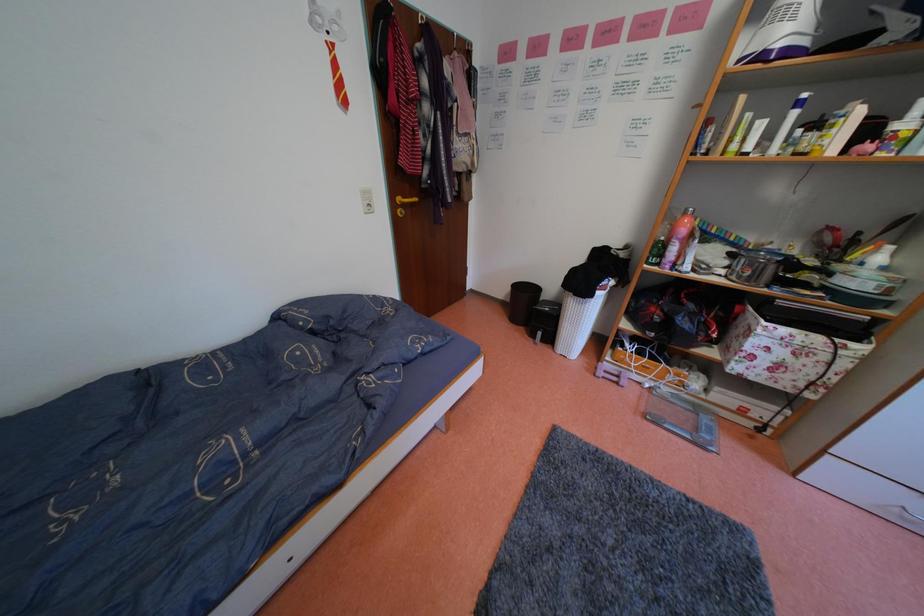
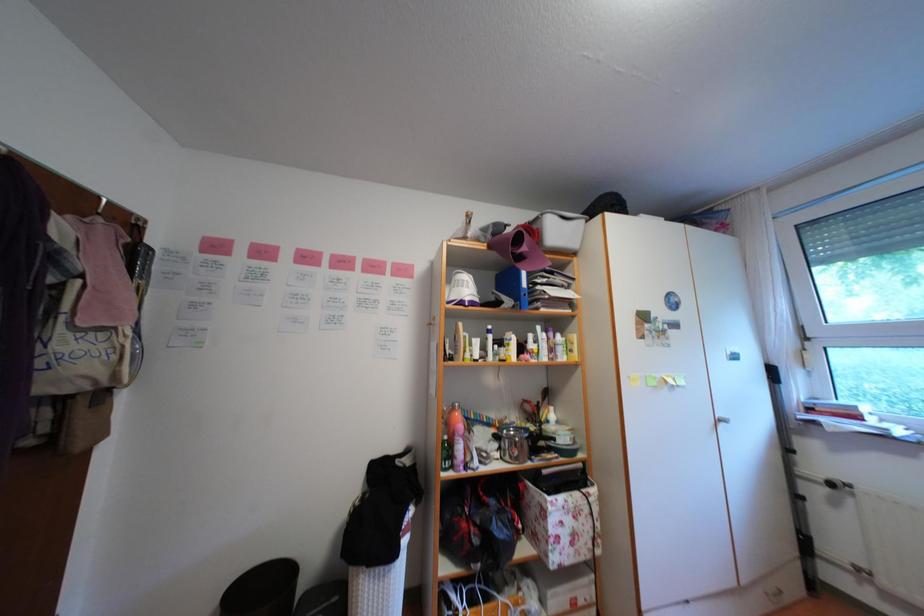
The images are taken continuously from a first-person perspective. In which direction is your viewpoint rotating?

The camera's rotation is toward right-up.